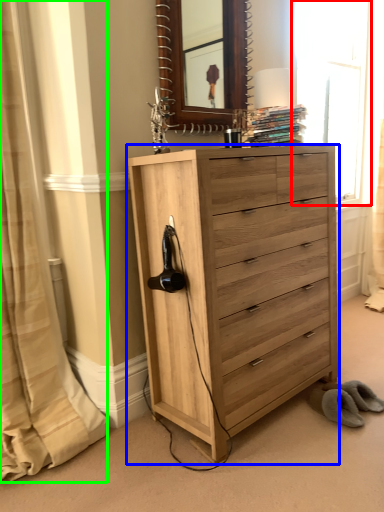
Question: Estimate the real-world distances between objects in this image. Which object is farther from window (highlighted by a red box), chest of drawers (highlighted by a blue box) or curtain (highlighted by a green box)?

Choices:
 (A) chest of drawers
 (B) curtain

Answer: (B)